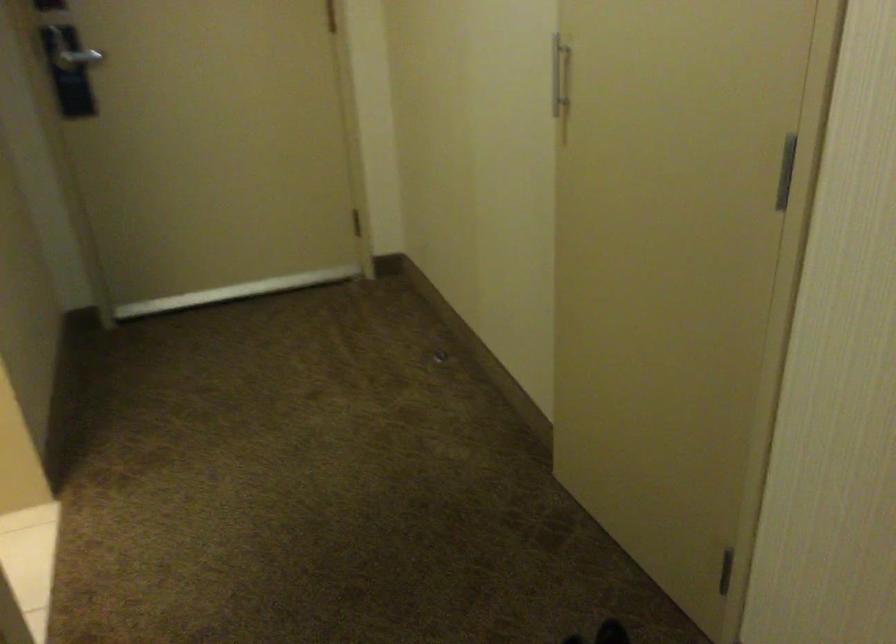
Where is `silver door handle`? The height and width of the screenshot is (644, 896). silver door handle is located at coordinates (73, 53).